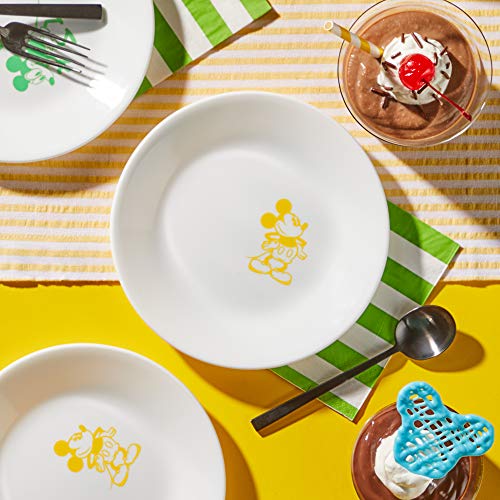
Locate an element on the screen. brown dish is located at coordinates (362, 482).